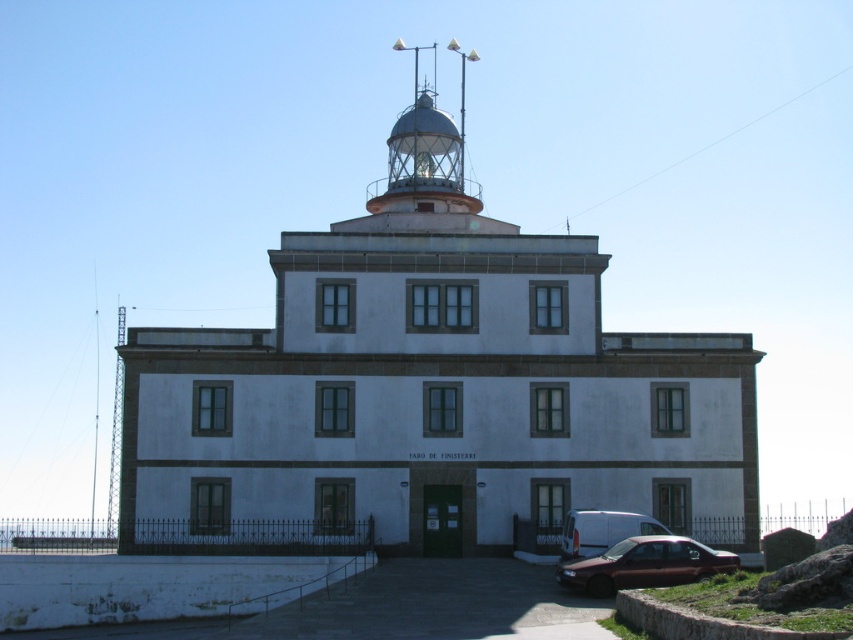
You are standing in front of the lighthouse and want to take a photo of the metallic dome at upper center and the metallic silver van at lower center. Which object will appear larger in the photo?

The metallic dome at upper center will appear larger in the photo because it is closer to the viewer than the metallic silver van at lower center.

You are a visitor standing in front of the two story building. You notice the white stone tower at center and the metallic dome at upper center. Which object is closer to you from your current position?

The white stone tower at center is closer to you because it is in front of the metallic dome at upper center.